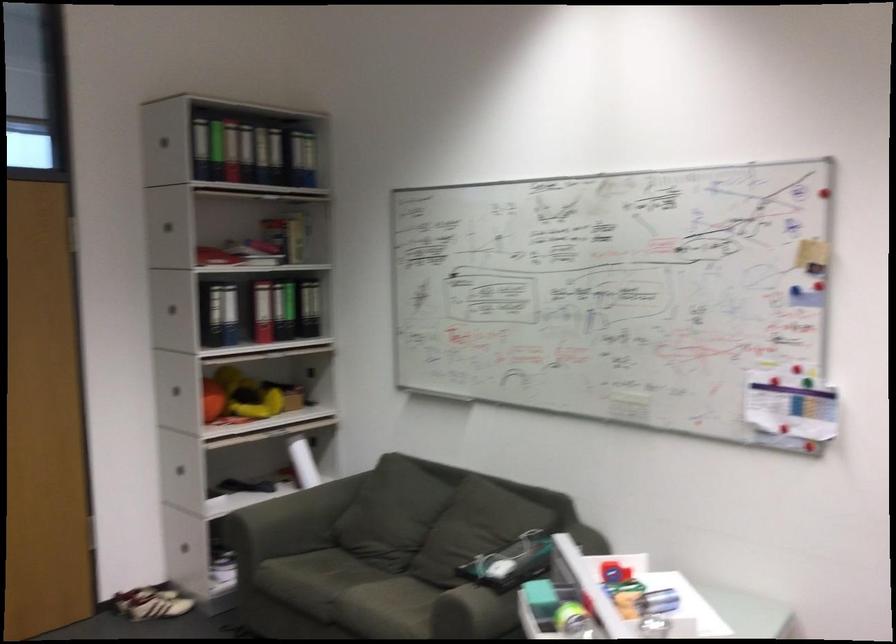
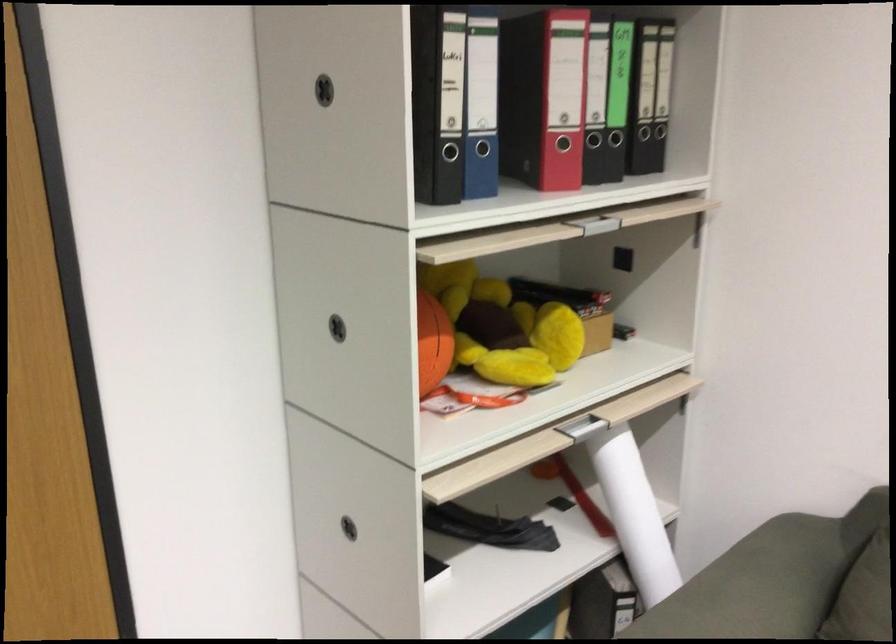
Where in the second image is the point corresponding to (x=176, y=484) from the first image?

(348, 527)